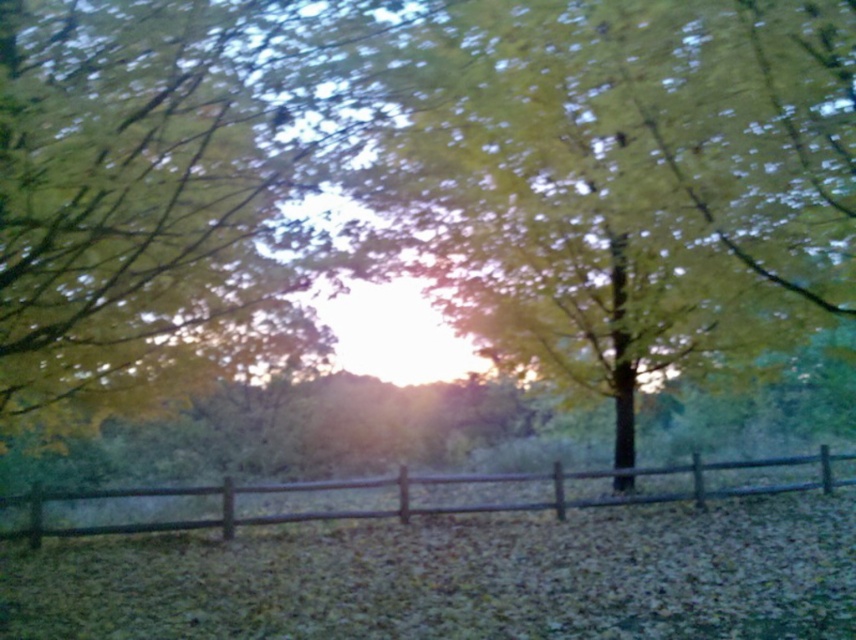
Question: Can you confirm if green matte tree at center is smaller than brown wooden fence at lower center?

Choices:
 (A) no
 (B) yes

Answer: (A)

Question: Does green matte tree at center appear under brown wooden fence at lower center?

Choices:
 (A) yes
 (B) no

Answer: (B)

Question: Which point appears closest to the camera in this image?

Choices:
 (A) 278,515
 (B) 556,195

Answer: (B)

Question: Which point appears farthest from the camera in this image?

Choices:
 (A) (672, 170)
 (B) (690, 496)

Answer: (B)

Question: Does green matte tree at center appear on the right side of brown wooden fence at lower center?

Choices:
 (A) yes
 (B) no

Answer: (A)

Question: Which point is farther to the camera?

Choices:
 (A) (788, 483)
 (B) (562, 289)

Answer: (A)